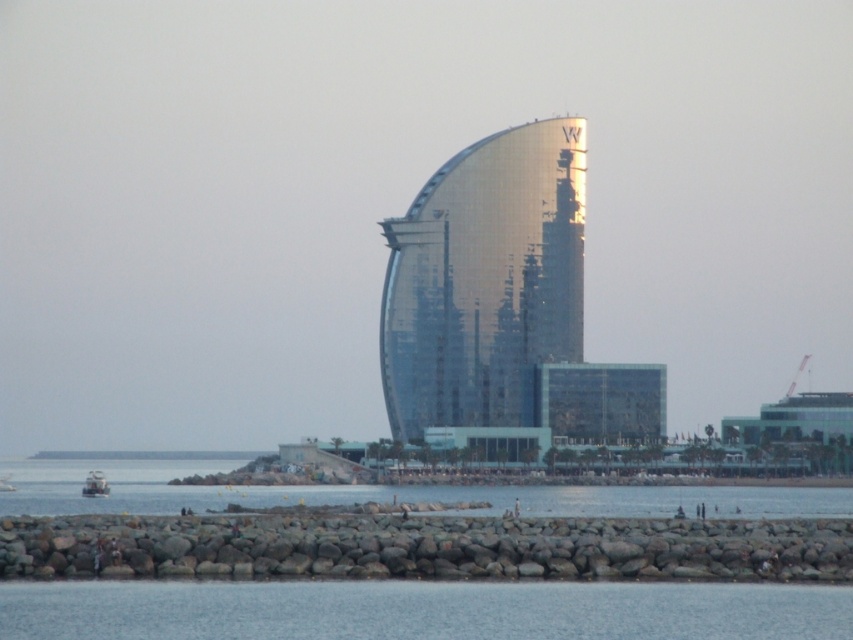
Question: Is the position of glossy glass tower at center less distant than that of transparent water at lower center?

Choices:
 (A) yes
 (B) no

Answer: (B)

Question: Which point is farther from the camera taking this photo?

Choices:
 (A) (268, 605)
 (B) (440, 355)

Answer: (B)

Question: Does glossy glass tower at center lie behind transparent water at lower center?

Choices:
 (A) no
 (B) yes

Answer: (B)

Question: Based on their relative distances, which object is nearer to the transparent water at lower center?

Choices:
 (A) glossy glass tower at center
 (B) rocky shore at lower center

Answer: (B)

Question: Estimate the real-world distances between objects in this image. Which object is closer to the rocky shore at lower center?

Choices:
 (A) transparent water at lower center
 (B) glossy glass tower at center

Answer: (A)

Question: In this image, where is glossy glass tower at center located relative to transparent water at lower center?

Choices:
 (A) below
 (B) above

Answer: (B)